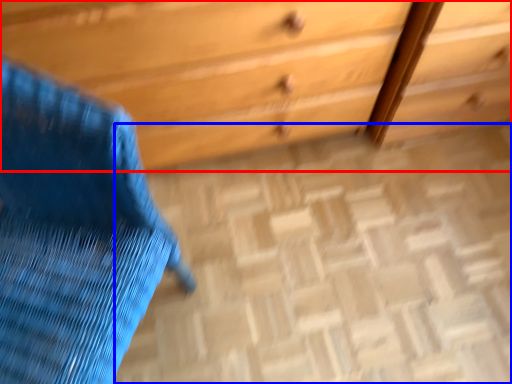
Question: Among these objects, which one is farthest to the camera, chest of drawers (highlighted by a red box) or plain (highlighted by a blue box)?

Choices:
 (A) chest of drawers
 (B) plain

Answer: (B)